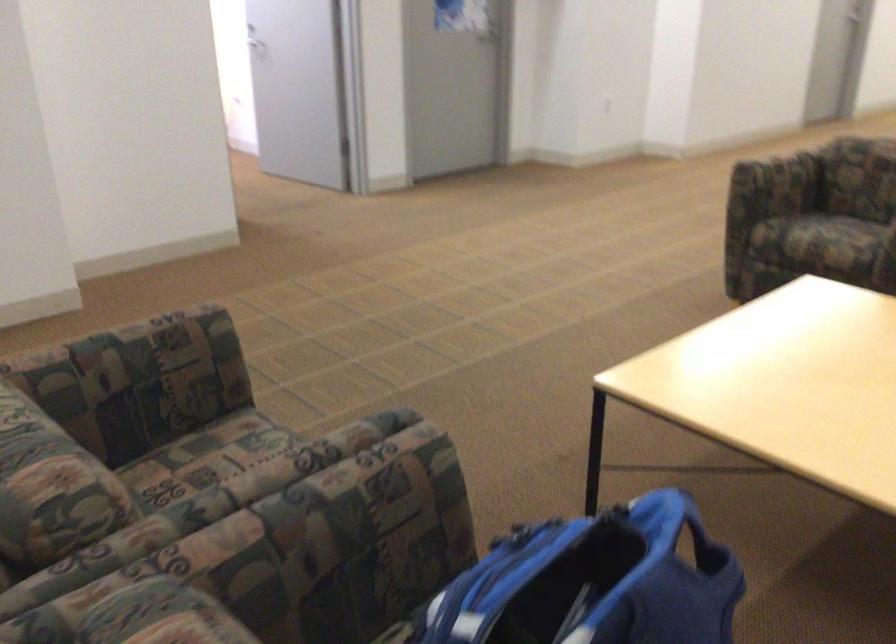
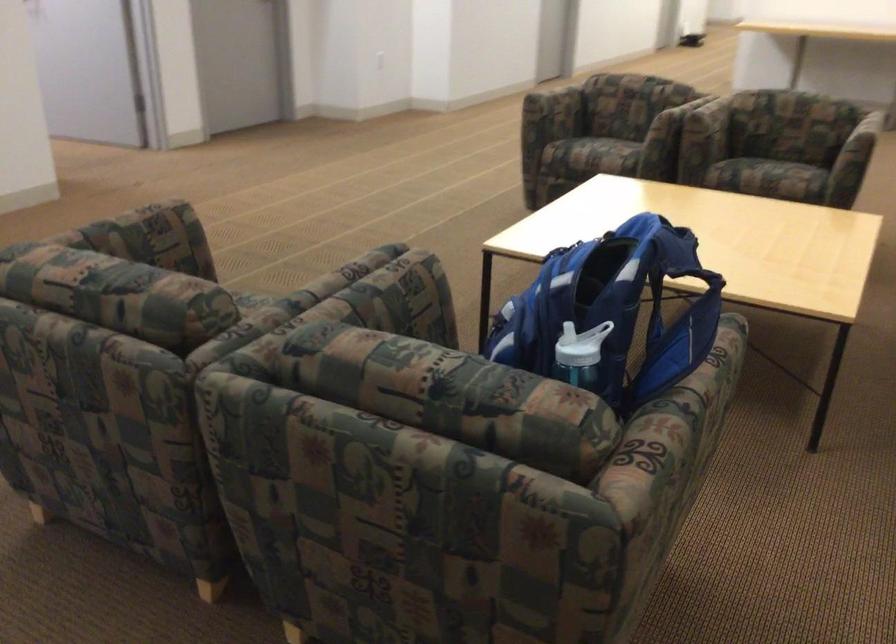
Locate, in the second image, the point that corresponds to pixel 300 504 in the first image.

(362, 292)